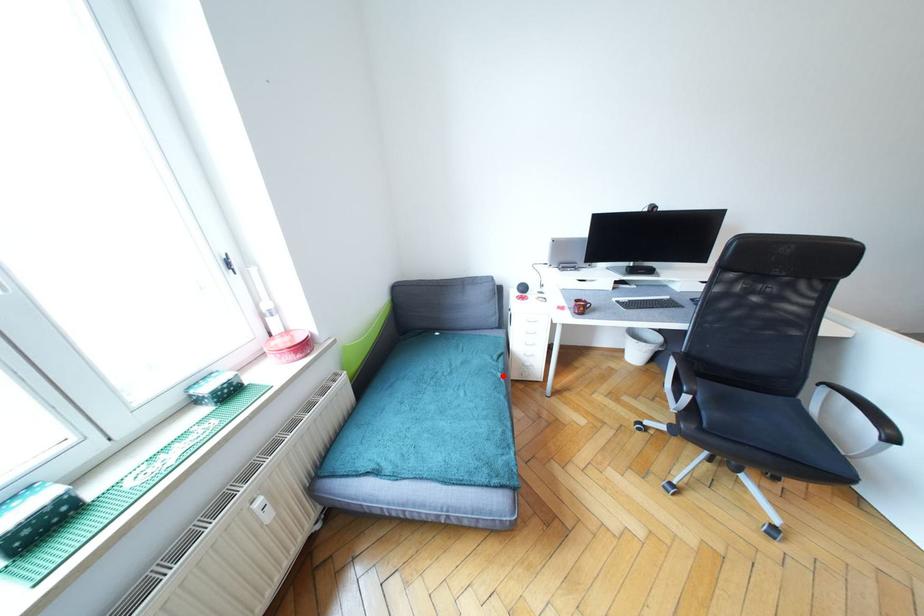
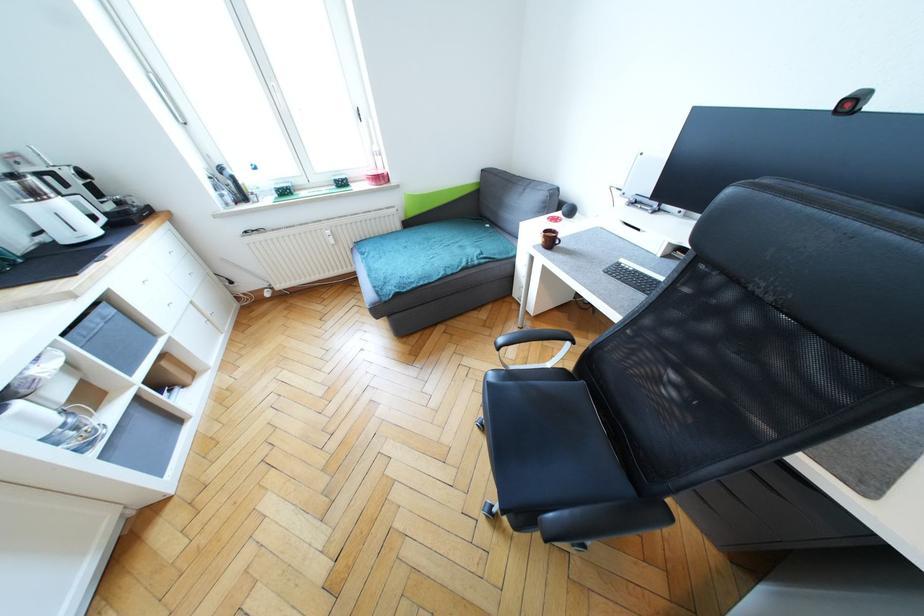
Find the pixel in the second image that matches the highlighted location in the first image.

(467, 265)